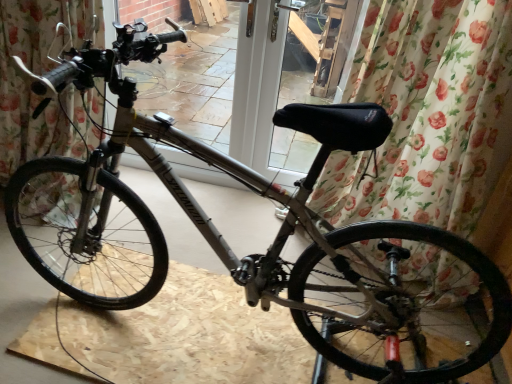
Question: Looking at their shapes, would you say floral fabric curtain at center, the 2th curtain from the left, is wider or thinner than matte gray bicycle at center?

Choices:
 (A) thin
 (B) wide

Answer: (A)

Question: Is floral fabric curtain at center, the 2th curtain from the left, taller or shorter than matte gray bicycle at center?

Choices:
 (A) tall
 (B) short

Answer: (A)

Question: Considering the real-world distances, which object is closest to the matte gray bicycle at center?

Choices:
 (A) matte black handlebars at upper center
 (B) floral fabric curtain at center, the 2th curtain from the left
 (C) floral fabric curtain at center, which is the 2th curtain from right to left

Answer: (C)

Question: Based on their relative distances, which object is farther from the floral fabric curtain at center, marked as the first curtain in a right-to-left arrangement?

Choices:
 (A) matte black handlebars at upper center
 (B) matte gray bicycle at center
 (C) floral fabric curtain at center, the first curtain in the left-to-right sequence

Answer: (A)